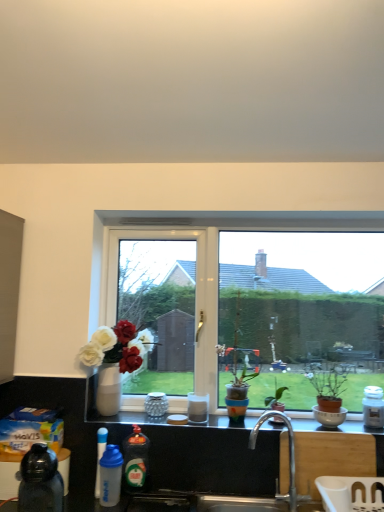
Describe the element at coordinates (100, 456) in the screenshot. I see `blue translucent bottle at lower left, the 4th bottle viewed from the right` at that location.

Measure the distance between green matte plant at center, the first houseplant positioned from the right, and camera.

The depth of green matte plant at center, the first houseplant positioned from the right, is 1.95 meters.

The height and width of the screenshot is (512, 384). I want to click on black matte water bottle at lower left, the 5th bottle when ordered from right to left, so click(x=40, y=481).

What do you see at coordinates (237, 369) in the screenshot? Image resolution: width=384 pixels, height=512 pixels. I see `multicolored terracotta pot at center, positioned as the second houseplant in right-to-left order` at bounding box center [237, 369].

The image size is (384, 512). What do you see at coordinates (156, 404) in the screenshot?
I see `porcelain textured cup at window, the 1th coffee cup when ordered from left to right` at bounding box center [156, 404].

Describe the element at coordinates (329, 417) in the screenshot. I see `white ceramic bowl at window` at that location.

Locate an element on the screen. blue translucent bottle at lower left, the 4th bottle viewed from the right is located at coordinates (100, 456).

Which object is further away from the camera taking this photo, green glossy dish soap at lower center, marked as the fourth bottle in a front-to-back arrangement, or black matte water bottle at lower left, the 1th bottle positioned from the front?

green glossy dish soap at lower center, marked as the fourth bottle in a front-to-back arrangement.

Which object is wider, green glossy dish soap at lower center, placed as the 2th bottle when sorted from back to front, or black matte water bottle at lower left, the 1th bottle positioned from the front?

Wider between the two is black matte water bottle at lower left, the 1th bottle positioned from the front.

Which object is thinner, blue translucent bottle at lower left, acting as the third bottle starting from the back, or white glossy window at center?

white glossy window at center.

From the image's perspective, is blue translucent bottle at lower left, the 4th bottle viewed from the right, below white glossy window at center?

Yes, from the image's perspective, blue translucent bottle at lower left, the 4th bottle viewed from the right, is beneath white glossy window at center.

Can you confirm if blue translucent bottle at lower left, the 4th bottle viewed from the right, is positioned to the right of white glossy window at center?

Incorrect, blue translucent bottle at lower left, the 4th bottle viewed from the right, is not on the right side of white glossy window at center.

Can you tell me how much blue translucent bottle at lower left, the 4th bottle viewed from the right, and white glossy window at center differ in facing direction?

blue translucent bottle at lower left, the 4th bottle viewed from the right, and white glossy window at center are facing 0.222 degrees away from each other.

Would you say white ceramic bowl at window is outside blue translucent bottle at lower left, which is the 2th bottle from left to right?

Indeed, white ceramic bowl at window is completely outside blue translucent bottle at lower left, which is the 2th bottle from left to right.

From the image's perspective, which bottle is the 2nd one below the white ceramic bowl at window? Please provide its 2D coordinates.

[(100, 456)]

From the picture: Considering the relative sizes of white ceramic bowl at window and blue translucent bottle at lower left, acting as the third bottle starting from the back, in the image provided, is white ceramic bowl at window shorter than blue translucent bottle at lower left, acting as the third bottle starting from the back,?

Yes.

Is white ceramic bowl at window further to camera compared to blue translucent bottle at lower left, the third bottle positioned from the front?

Yes, the depth of white ceramic bowl at window is greater than that of blue translucent bottle at lower left, the third bottle positioned from the front.

From the image's perspective, is black matte window sill at lower center on top of blue translucent bottle at lower left, the 4th bottle viewed from the right?

Yes.

Considering the relative sizes of black matte window sill at lower center and blue translucent bottle at lower left, the third bottle positioned from the front, in the image provided, is black matte window sill at lower center smaller than blue translucent bottle at lower left, the third bottle positioned from the front,?

No.

Can we say black matte window sill at lower center lies outside blue translucent bottle at lower left, which is the 2th bottle from left to right?

Yes, black matte window sill at lower center is outside of blue translucent bottle at lower left, which is the 2th bottle from left to right.

Does black matte window sill at lower center touch blue translucent bottle at lower left, the 4th bottle viewed from the right?

No, black matte window sill at lower center is not touching blue translucent bottle at lower left, the 4th bottle viewed from the right.

Considering the points (157, 392) and (96, 421), which point is in front, point (157, 392) or point (96, 421)?

Point (96, 421)

The height and width of the screenshot is (512, 384). What are the coordinates of `the 2nd coffee cup to the left when counting from the black matte window sill at lower center` in the screenshot? It's located at (156, 404).

In the scene shown: Is porcelain textured cup at window, which ranks as the first coffee cup in back-to-front order, aimed at black matte window sill at lower center?

No, porcelain textured cup at window, which ranks as the first coffee cup in back-to-front order, is not oriented towards black matte window sill at lower center.

Considering the relative sizes of blue translucent bottle at lower left, the 3th bottle when ordered from right to left, and white glossy window at center in the image provided, is blue translucent bottle at lower left, the 3th bottle when ordered from right to left, smaller than white glossy window at center?

Yes, blue translucent bottle at lower left, the 3th bottle when ordered from right to left, is smaller than white glossy window at center.

Is blue translucent bottle at lower left, positioned as the 2th bottle in front-to-back order, oriented away from white glossy window at center?

No, blue translucent bottle at lower left, positioned as the 2th bottle in front-to-back order, is not facing the opposite direction of white glossy window at center.

What's the angular difference between blue translucent bottle at lower left, the fourth bottle when ordered from back to front, and white glossy window at center's facing directions?

blue translucent bottle at lower left, the fourth bottle when ordered from back to front, and white glossy window at center are facing 0.221 degrees away from each other.

Is blue translucent bottle at lower left, the 3th bottle positioned from the left, not close to green glossy dish soap at lower center, positioned as the 4th bottle in left-to-right order?

They are positioned close to each other.

Which is correct: blue translucent bottle at lower left, the 3th bottle when ordered from right to left, is inside green glossy dish soap at lower center, marked as the fourth bottle in a front-to-back arrangement, or outside of it?

blue translucent bottle at lower left, the 3th bottle when ordered from right to left, cannot be found inside green glossy dish soap at lower center, marked as the fourth bottle in a front-to-back arrangement.

Starting from the green glossy dish soap at lower center, marked as the fourth bottle in a front-to-back arrangement, which bottle is the 3rd one in front? Please provide its 2D coordinates.

[(40, 481)]

Locate an element on the screen. bottle that is the 3rd one when counting leftward from the white glossy window at center is located at coordinates (100, 456).

Based on their spatial positions, is white ceramic bowl at window or blue translucent bottle at lower left, the fourth bottle when ordered from back to front, further from white matte jar at right, the 5th bottle from the front?

blue translucent bottle at lower left, the fourth bottle when ordered from back to front, is positioned further to the anchor white matte jar at right, the 5th bottle from the front.

Which object lies nearer to the anchor point blue translucent bottle at lower left, the fourth bottle when ordered from back to front, white ceramic bowl at window or silver metallic faucet at center?

silver metallic faucet at center lies closer to blue translucent bottle at lower left, the fourth bottle when ordered from back to front, than the other object.

Considering their positions, is green glossy dish soap at lower center, acting as the second bottle starting from the right, positioned closer to black matte water bottle at lower left, positioned as the 1th bottle in left-to-right order, than white matte jar at right, the 5th bottle from the front?

Among the two, green glossy dish soap at lower center, acting as the second bottle starting from the right, is located nearer to black matte water bottle at lower left, positioned as the 1th bottle in left-to-right order.

Looking at the image, which one is located closer to blue translucent bottle at lower left, which is the 2th bottle from left to right, white matte jar at right, which appears as the first bottle when viewed from the right, or white glossy coffee cup at center, placed as the 1th coffee cup when sorted from right to left?

white glossy coffee cup at center, placed as the 1th coffee cup when sorted from right to left, lies closer to blue translucent bottle at lower left, which is the 2th bottle from left to right, than the other object.

Estimate the real-world distances between objects in this image. Which object is further from porcelain textured cup at window, which is the second coffee cup in right-to-left order, white matte jar at right, arranged as the fifth bottle when viewed from the left, or black matte window sill at lower center?

The object further to porcelain textured cup at window, which is the second coffee cup in right-to-left order, is white matte jar at right, arranged as the fifth bottle when viewed from the left.

Which object lies further to the anchor point blue translucent bottle at lower left, the 4th bottle viewed from the right, blue translucent bottle at lower left, the 3th bottle when ordered from right to left, or black matte water bottle at lower left, the 5th bottle when ordered from right to left?

The object further to blue translucent bottle at lower left, the 4th bottle viewed from the right, is black matte water bottle at lower left, the 5th bottle when ordered from right to left.

Which object lies further to the anchor point silver metallic faucet at center, white glossy coffee cup at center, the second coffee cup viewed from the left, or multicolored terracotta pot at center, positioned as the second houseplant in right-to-left order?

white glossy coffee cup at center, the second coffee cup viewed from the left, is further to silver metallic faucet at center.

Based on their spatial positions, is green matte plant at center, acting as the second houseplant starting from the left, or white glossy coffee cup at center, which is the first coffee cup in front-to-back order, further from multicolored terracotta pot at center, the first houseplant when ordered from left to right?

The object further to multicolored terracotta pot at center, the first houseplant when ordered from left to right, is white glossy coffee cup at center, which is the first coffee cup in front-to-back order.

I want to click on coffee cup that lies between white glossy window at center and porcelain textured cup at window, the 1th coffee cup when ordered from left to right, from top to bottom, so click(x=198, y=408).

Locate an element on the screen. The height and width of the screenshot is (512, 384). tap located between black matte water bottle at lower left, positioned as the 1th bottle in left-to-right order, and white ceramic bowl at window in the left-right direction is located at coordinates (289, 449).

This screenshot has height=512, width=384. What are the coordinates of `window between black matte water bottle at lower left, acting as the fifth bottle starting from the back, and silver metallic faucet at center, in the horizontal direction` in the screenshot? It's located at (252, 309).

You are a GUI agent. You are given a task and a screenshot of the screen. Output one action in this format:
    pyautogui.click(x=<x>, y=<y>)
    Task: Click on the window sill between blue translucent bottle at lower left, the third bottle positioned from the front, and white ceramic bowl at window, in the horizontal direction
    The width and height of the screenshot is (384, 512).
    Given the screenshot: What is the action you would take?
    pyautogui.click(x=331, y=428)